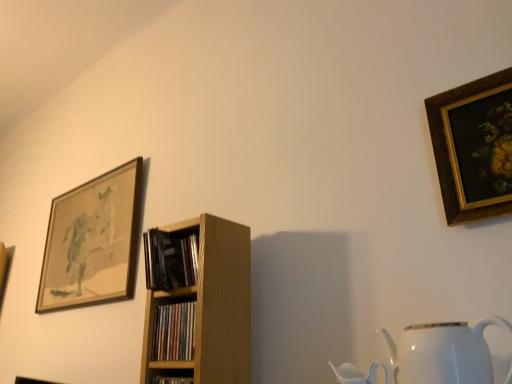
Question: Is wooden shelf at center to the left of wooden framed artwork at upper left, the 1th picture frame from the left, from the viewer's perspective?

Choices:
 (A) no
 (B) yes

Answer: (A)

Question: Is wooden shelf at center wider than wooden framed artwork at upper left, which is the first picture frame in back-to-front order?

Choices:
 (A) no
 (B) yes

Answer: (B)

Question: Is wooden shelf at center thinner than wooden framed artwork at upper left, the 1th picture frame from the left?

Choices:
 (A) no
 (B) yes

Answer: (A)

Question: From a real-world perspective, is wooden shelf at center below wooden framed artwork at upper left, the 1th picture frame from the left?

Choices:
 (A) yes
 (B) no

Answer: (A)

Question: Does wooden shelf at center touch wooden framed artwork at upper left, the 1th picture frame from the left?

Choices:
 (A) yes
 (B) no

Answer: (B)

Question: Is the depth of wooden shelf at center greater than that of wooden framed artwork at upper left, which is the first picture frame in back-to-front order?

Choices:
 (A) no
 (B) yes

Answer: (A)

Question: Is wooden bookshelf at center, positioned as the second book in top-to-bottom order, smaller than wooden bookshelf at center, marked as the second book in a bottom-to-top arrangement?

Choices:
 (A) no
 (B) yes

Answer: (A)

Question: From the image's perspective, is wooden bookshelf at center, positioned as the second book in top-to-bottom order, below wooden bookshelf at center, marked as the second book in a bottom-to-top arrangement?

Choices:
 (A) yes
 (B) no

Answer: (A)

Question: Considering the relative sizes of wooden bookshelf at center, positioned as the second book in top-to-bottom order, and wooden bookshelf at center, marked as the second book in a bottom-to-top arrangement, in the image provided, is wooden bookshelf at center, positioned as the second book in top-to-bottom order, thinner than wooden bookshelf at center, marked as the second book in a bottom-to-top arrangement,?

Choices:
 (A) no
 (B) yes

Answer: (B)

Question: Is wooden bookshelf at center, acting as the first book starting from the bottom, oriented towards wooden bookshelf at center, marked as the second book in a bottom-to-top arrangement?

Choices:
 (A) no
 (B) yes

Answer: (A)

Question: Is the depth of wooden bookshelf at center, acting as the first book starting from the bottom, greater than that of wooden bookshelf at center, marked as the second book in a bottom-to-top arrangement?

Choices:
 (A) yes
 (B) no

Answer: (B)

Question: Is wooden bookshelf at center, positioned as the second book in top-to-bottom order, taller than wooden bookshelf at center, placed as the 1th book when sorted from top to bottom?

Choices:
 (A) no
 (B) yes

Answer: (A)

Question: Is white glossy jug at lower right at the right side of gold-framed painting at upper right, the 1th picture frame positioned from the front?

Choices:
 (A) yes
 (B) no

Answer: (B)